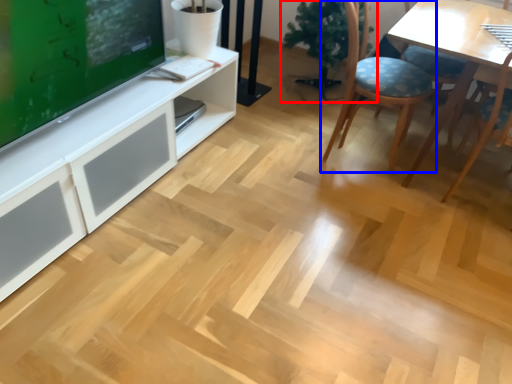
Question: Among these objects, which one is nearest to the camera, houseplant (highlighted by a red box) or chair (highlighted by a blue box)?

Choices:
 (A) houseplant
 (B) chair

Answer: (B)